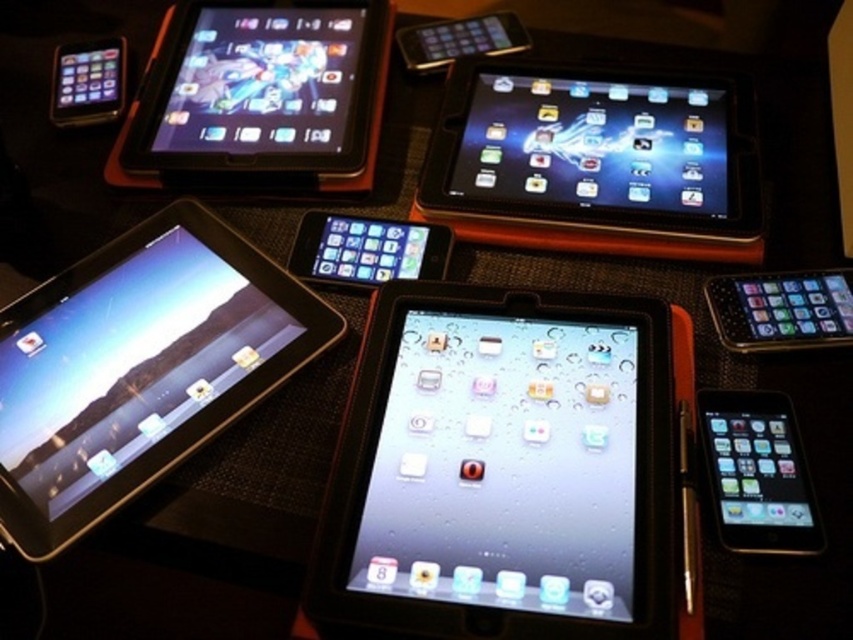
Question: Which point is closer to the camera taking this photo?

Choices:
 (A) (47, 284)
 (B) (219, 49)
 (C) (514, 573)
 (D) (344, 237)

Answer: (C)

Question: Does satin black tablet at lower left appear over matte black tablet at center?

Choices:
 (A) no
 (B) yes

Answer: (A)

Question: Based on their relative distances, which object is nearer to the matte black tablet at center?

Choices:
 (A) satin black tablet at upper center
 (B) matte black tablet at upper center
 (C) black glossy tablet at upper right

Answer: (A)

Question: Does black glossy tablet at lower right have a smaller size compared to matte black tablet at center?

Choices:
 (A) yes
 (B) no

Answer: (B)

Question: Which point appears closest to the camera in this image?

Choices:
 (A) (786, 536)
 (B) (538, 301)

Answer: (A)

Question: Can you confirm if black glossy tablet at lower right is wider than black glossy tablet at upper right?

Choices:
 (A) no
 (B) yes

Answer: (A)